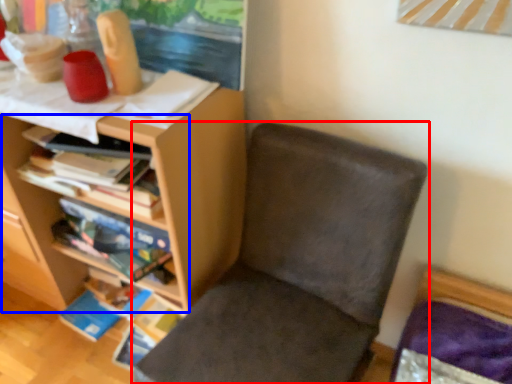
Question: Which object appears farthest to the camera in this image, chair (highlighted by a red box) or shelf (highlighted by a blue box)?

Choices:
 (A) chair
 (B) shelf

Answer: (B)